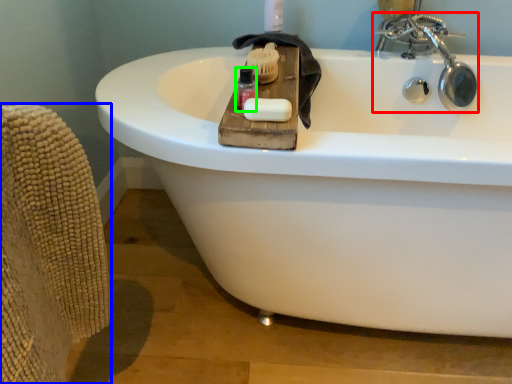
Question: Which object is the closest to the tap (highlighted by a red box)? Choose among these: armchair (highlighted by a blue box) or mouthwash (highlighted by a green box).

Choices:
 (A) armchair
 (B) mouthwash

Answer: (B)